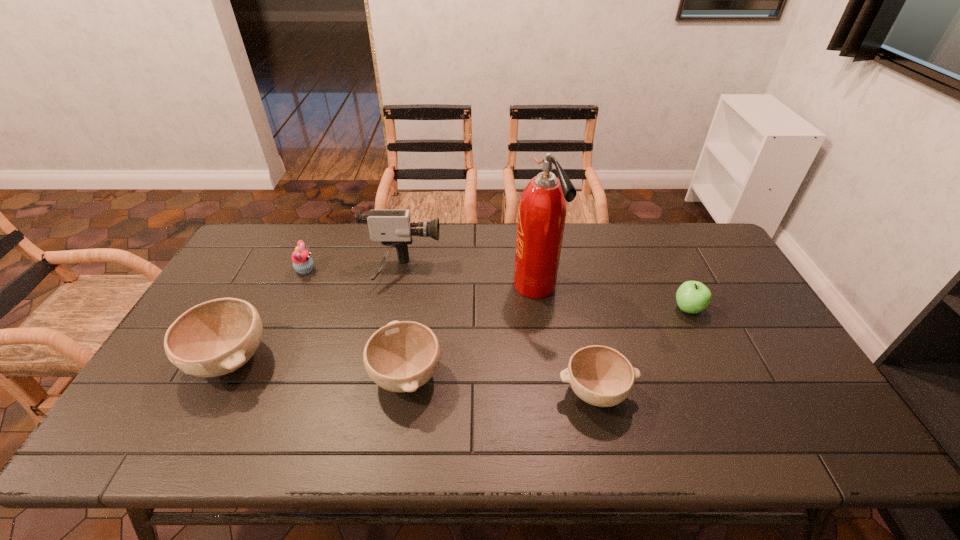
Identify the location of vacant space situated on the recording direction of the camcorder. (459, 272).

You are a GUI agent. You are given a task and a screenshot of the screen. Output one action in this format:
    pyautogui.click(x=<x>, y=<y>)
    Task: Click on the vacant space located on the right of the tallest object
    This screenshot has width=960, height=540.
    Given the screenshot: What is the action you would take?
    pyautogui.click(x=649, y=287)

This screenshot has height=540, width=960. What are the coordinates of `free spot located 0.230m on the face of the cupcake` in the screenshot? It's located at (386, 270).

Find the location of a particular element. This screenshot has width=960, height=540. free region located on the back of the apple is located at coordinates (650, 230).

Where is `camcorder at the far edge`? camcorder at the far edge is located at coordinates (393, 228).

Identify the location of cupcake that is at the far edge. The height and width of the screenshot is (540, 960). (302, 262).

What are the coordinates of `object that is at the left edge` in the screenshot? It's located at (214, 338).

Locate an element on the screen. The width and height of the screenshot is (960, 540). object at the right edge is located at coordinates 692,297.

At what (x,y) coordinates should I click in order to perform the action: click on object located in the near left corner section of the desktop. Please return your answer as a coordinate pair (x, y). The width and height of the screenshot is (960, 540). Looking at the image, I should click on (214, 338).

The width and height of the screenshot is (960, 540). What are the coordinates of `free space at the far edge of the desktop` in the screenshot? It's located at pyautogui.click(x=347, y=239).